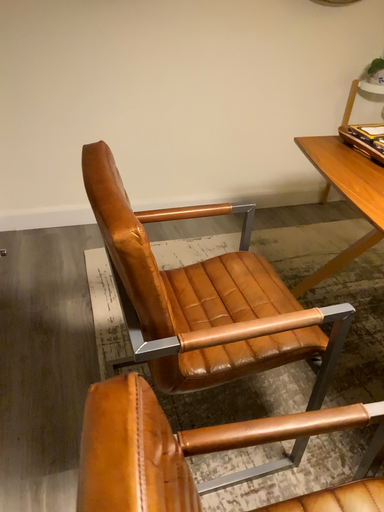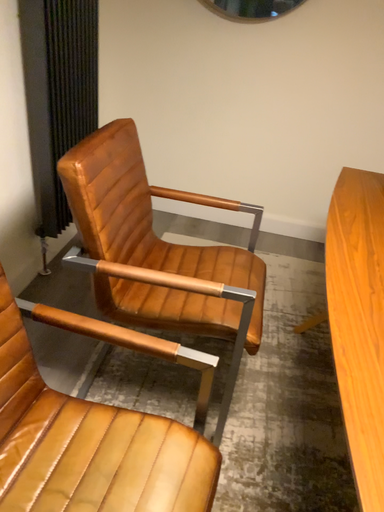
Question: Which way did the camera rotate in the video?

Choices:
 (A) rotated upward
 (B) rotated downward

Answer: (A)